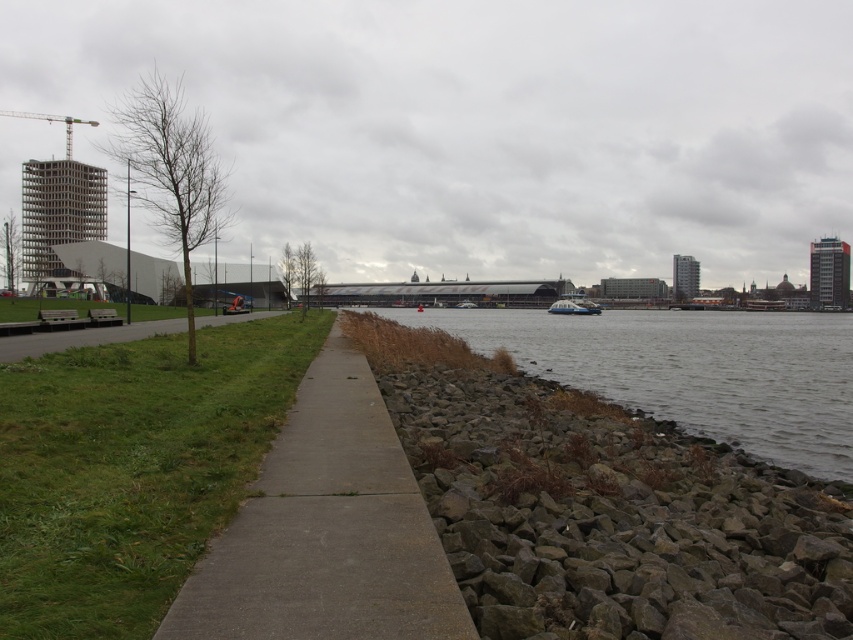
You are standing at the point labeled as point (326,531) in the image. Based on the scene description, what type of surface are you currently standing on?

The point (326,531) corresponds to the concrete sidewalk at center, so you are standing on a concrete sidewalk.

You are planning to install a new bench along the waterfront. The bench requires a flat, stable surface that can accommodate its base. Considering the concrete sidewalk at center and the gray stone river at center, which location would be more suitable for placing the bench?

The concrete sidewalk at center is more suitable for placing the bench because it provides a flat and stable surface, unlike the gray stone river at center which has irregularly shaped rocks and may not be stable enough for a bench base.

You are walking along the waterfront and want to cross from the concrete sidewalk at center to the gray stone river at center. Which direction should you head to reach the river?

The concrete sidewalk at center is to the left of the gray stone river at center. To reach the river, you should head to the right from the sidewalk.